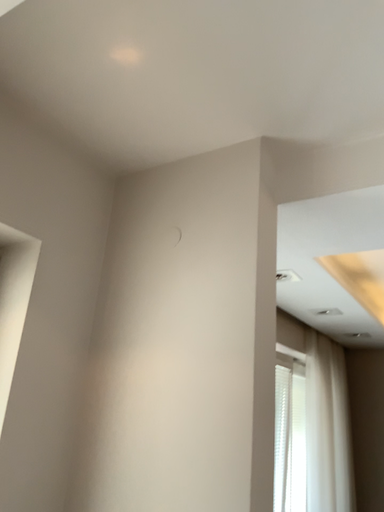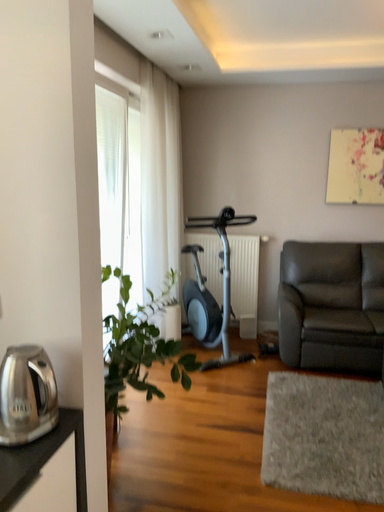
Question: Which way did the camera rotate in the video?

Choices:
 (A) rotated right
 (B) rotated left

Answer: (A)